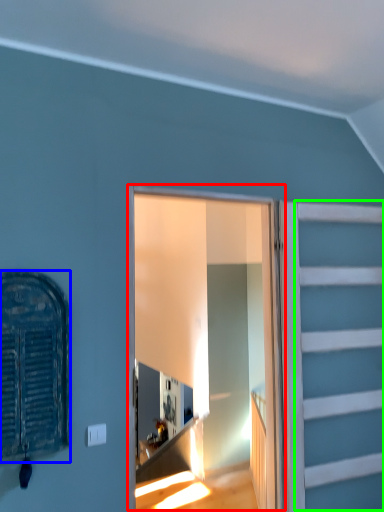
Question: Which object is positioned farthest from window frame (highlighted by a red box)? Select from window (highlighted by a blue box) and garage door (highlighted by a green box).

Choices:
 (A) window
 (B) garage door

Answer: (A)